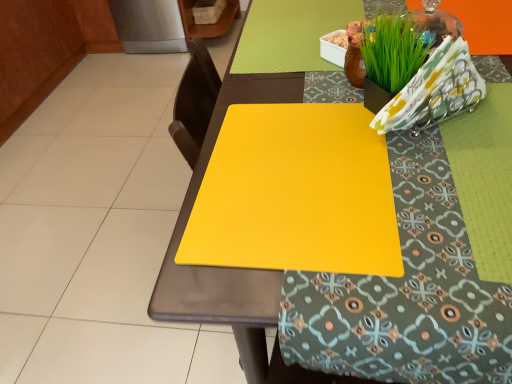
Locate an element on the screen. blank space situated above yellow matte placemat at center (from a real-world perspective) is located at coordinates (338, 73).